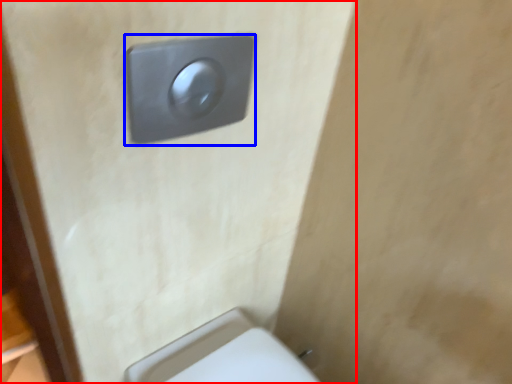
Question: Which of the following is the farthest to the observer, door (highlighted by a red box) or light switch (highlighted by a blue box)?

Choices:
 (A) door
 (B) light switch

Answer: (B)